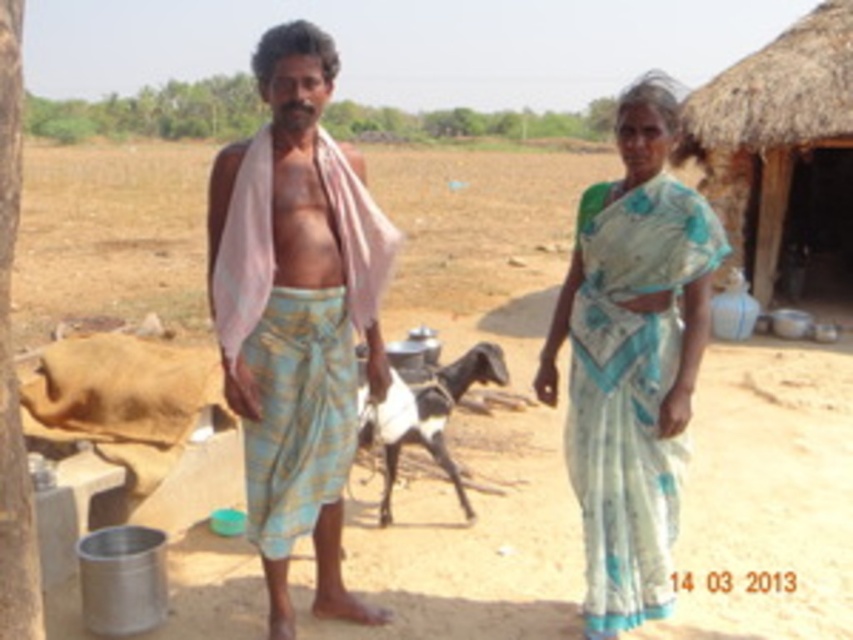
Question: Is light blue printed saree at center above black and white fur goat at center?

Choices:
 (A) no
 (B) yes

Answer: (A)

Question: Does white silk saree at center appear under thatched straw hut at right?

Choices:
 (A) yes
 (B) no

Answer: (A)

Question: Considering the real-world distances, which object is closest to the black and white fur goat at center?

Choices:
 (A) light blue printed saree at center
 (B) white silk saree at center

Answer: (A)

Question: Considering the real-world distances, which object is farthest from the light blue printed saree at center?

Choices:
 (A) light blue woven dhoti at center
 (B) black and white fur goat at center

Answer: (A)

Question: Can you confirm if light blue woven dhoti at center is positioned to the left of black and white fur goat at center?

Choices:
 (A) no
 (B) yes

Answer: (B)

Question: Estimate the real-world distances between objects in this image. Which object is farther from the black and white fur goat at center?

Choices:
 (A) light blue woven dhoti at center
 (B) light blue printed saree at center
 (C) thatched straw hut at right
 (D) white silk saree at center

Answer: (C)